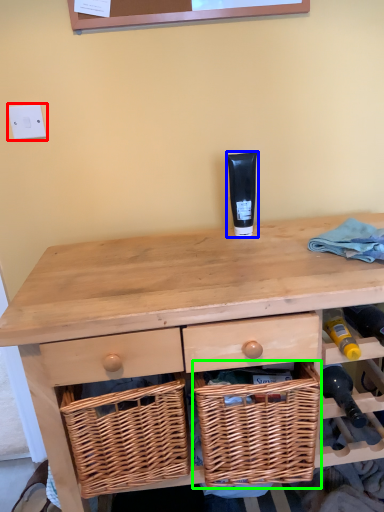
Question: Based on their relative distances, which object is nearer to electric outlet (highlighted by a red box)? Choose from toiletry (highlighted by a blue box) and picnic basket (highlighted by a green box).

Choices:
 (A) toiletry
 (B) picnic basket

Answer: (A)